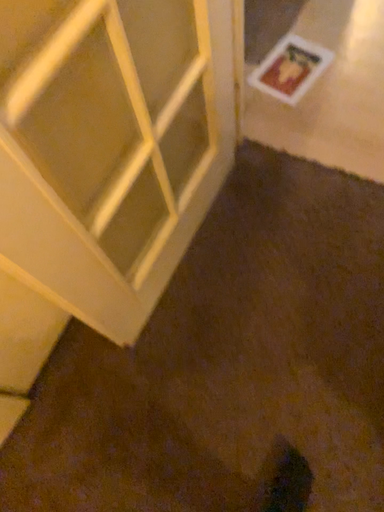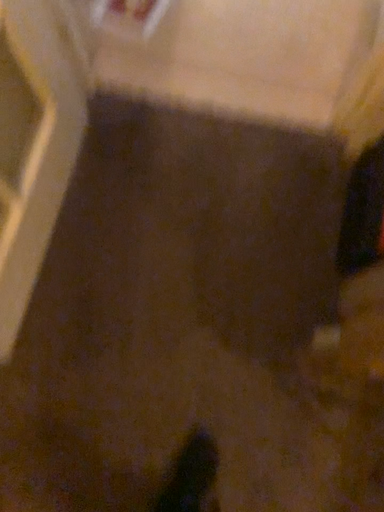
Question: How did the camera likely rotate when shooting the video?

Choices:
 (A) rotated left
 (B) rotated right

Answer: (B)